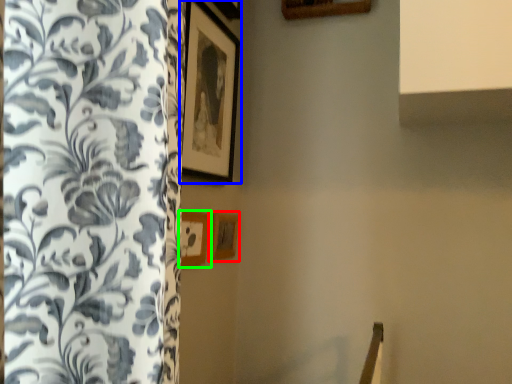
Question: Considering the real-world distances, which object is farthest from picture frame (highlighted by a red box)? picture frame (highlighted by a blue box) or picture frame (highlighted by a green box)?

Choices:
 (A) picture frame
 (B) picture frame

Answer: (A)